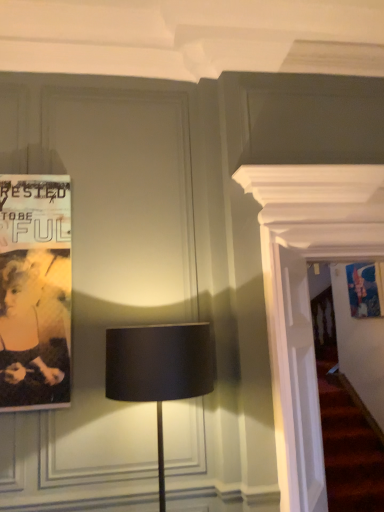
Question: From their relative heights in the image, would you say matte black lamp at center is taller or shorter than black paper poster at left?

Choices:
 (A) short
 (B) tall

Answer: (A)

Question: Considering the positions of matte black lamp at center and black paper poster at left in the image, is matte black lamp at center bigger or smaller than black paper poster at left?

Choices:
 (A) small
 (B) big

Answer: (B)

Question: Is matte black lamp at center in front of or behind black paper poster at left in the image?

Choices:
 (A) front
 (B) behind

Answer: (A)

Question: Is point (13, 309) positioned closer to the camera than point (120, 359)?

Choices:
 (A) farther
 (B) closer

Answer: (A)

Question: Based on their sizes in the image, would you say black paper poster at left is bigger or smaller than matte black lamp at center?

Choices:
 (A) small
 (B) big

Answer: (A)

Question: Considering the positions of black paper poster at left and matte black lamp at center in the image, is black paper poster at left taller or shorter than matte black lamp at center?

Choices:
 (A) short
 (B) tall

Answer: (B)

Question: In the image, is black paper poster at left on the left side or the right side of matte black lamp at center?

Choices:
 (A) left
 (B) right

Answer: (A)